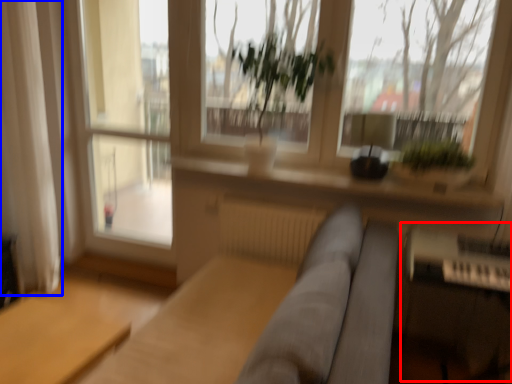
Question: Which point is further to the camera, piano (highlighted by a red box) or curtain (highlighted by a blue box)?

Choices:
 (A) piano
 (B) curtain

Answer: (B)